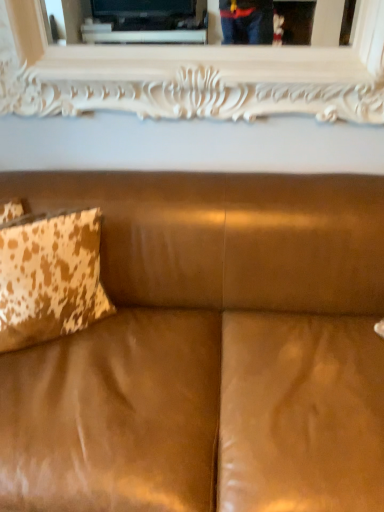
Question: Considering the relative sizes of cowhide-patterned pillow at left and suede brown couch at center in the image provided, is cowhide-patterned pillow at left bigger than suede brown couch at center?

Choices:
 (A) no
 (B) yes

Answer: (A)

Question: Considering the relative sizes of cowhide-patterned pillow at left and suede brown couch at center in the image provided, is cowhide-patterned pillow at left thinner than suede brown couch at center?

Choices:
 (A) yes
 (B) no

Answer: (A)

Question: Does cowhide-patterned pillow at left have a greater height compared to suede brown couch at center?

Choices:
 (A) yes
 (B) no

Answer: (B)

Question: Would you say cowhide-patterned pillow at left is outside suede brown couch at center?

Choices:
 (A) yes
 (B) no

Answer: (B)

Question: Is cowhide-patterned pillow at left turned away from suede brown couch at center?

Choices:
 (A) yes
 (B) no

Answer: (A)

Question: Is cowhide-patterned pillow at left at the right side of suede brown couch at center?

Choices:
 (A) yes
 (B) no

Answer: (B)

Question: Is suede brown couch at center at the back of white carved wood picture frame at upper center?

Choices:
 (A) yes
 (B) no

Answer: (B)

Question: Can you confirm if white carved wood picture frame at upper center is smaller than suede brown couch at center?

Choices:
 (A) yes
 (B) no

Answer: (A)

Question: From the image's perspective, does white carved wood picture frame at upper center appear lower than suede brown couch at center?

Choices:
 (A) yes
 (B) no

Answer: (B)

Question: From a real-world perspective, is white carved wood picture frame at upper center physically above suede brown couch at center?

Choices:
 (A) yes
 (B) no

Answer: (A)

Question: Is white carved wood picture frame at upper center to the left of suede brown couch at center from the viewer's perspective?

Choices:
 (A) no
 (B) yes

Answer: (A)

Question: Could you tell me if white carved wood picture frame at upper center is facing suede brown couch at center?

Choices:
 (A) no
 (B) yes

Answer: (A)

Question: Is white carved wood picture frame at upper center surrounded by suede brown couch at center?

Choices:
 (A) no
 (B) yes

Answer: (A)